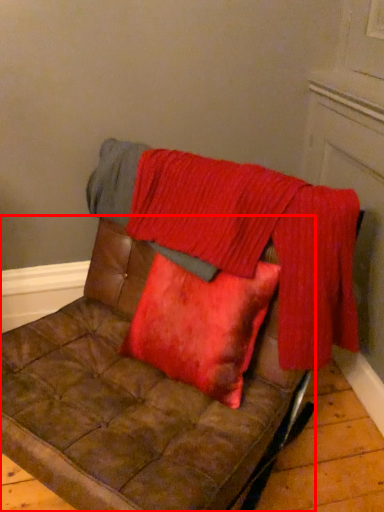
Question: From the image's perspective, where is furniture (annotated by the red box) located relative to blanket?

Choices:
 (A) below
 (B) above

Answer: (A)